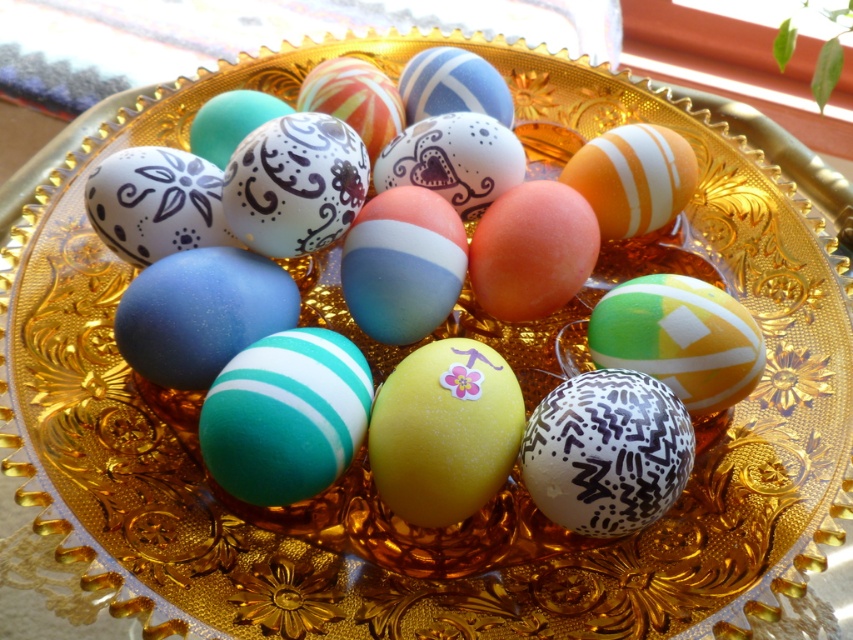
You are an art curator arranging a display of eggs. You have two eggs in front of you on a tray, the matte green and white striped egg at center and the matte orange egg at center. Which egg is positioned in front of the other?

The matte green and white striped egg at center is closer to the viewer than the matte orange egg at center, so it is positioned in front of the matte orange egg at center.

You are a collector who wants to place a new egg, which is 3 inches in diameter, between the matte green and white striped egg at center and the matte orange egg at center. Can the new egg fit in the space between them without overlapping?

The distance between the matte green and white striped egg at center and the matte orange egg at center is 4.53 inches. Since the new egg has a diameter of 3 inches, there is enough space between them to place it without overlapping. The minimum required space would be at least 3 inches, so 4.53 inches is sufficient.